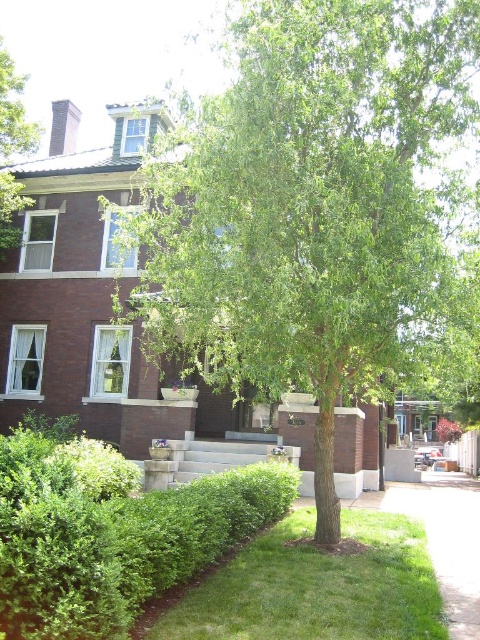
Image resolution: width=480 pixels, height=640 pixels. Describe the element at coordinates (309, 204) in the screenshot. I see `green leafy tree at center` at that location.

Is green leafy tree at center positioned at the back of green grass at lower center?

Yes.

Identify the location of green leafy tree at center. (309, 204).

Is green leafy hedge at lower left positioned behind green grass at lower center?

No, green leafy hedge at lower left is closer to the viewer.

In the scene shown: Can you confirm if green leafy hedge at lower left is wider than green grass at lower center?

Incorrect, green leafy hedge at lower left's width does not surpass green grass at lower center's.

Where is `green leafy hedge at lower left`? The image size is (480, 640). green leafy hedge at lower left is located at coordinates (111, 538).

This screenshot has width=480, height=640. I want to click on green leafy hedge at lower left, so click(111, 538).

Who is more distant from viewer, (421, 120) or (13, 93)?

Point (13, 93)

Is point (231, 252) positioned after point (15, 244)?

No, (231, 252) is in front of (15, 244).

This screenshot has height=640, width=480. What are the coordinates of `green leafy tree at center` in the screenshot? It's located at (309, 204).